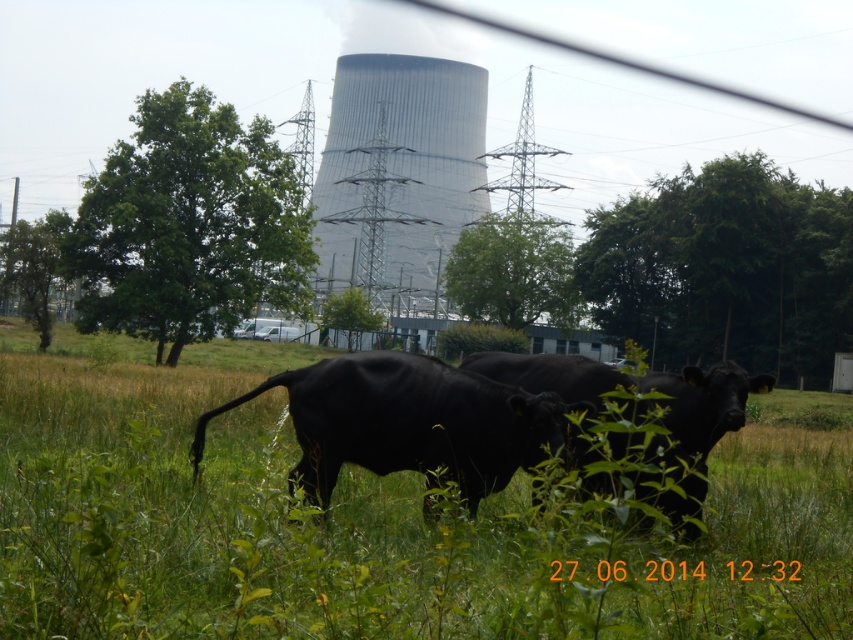
Question: Where is black matte cow at center located in relation to black glossy bull at center in the image?

Choices:
 (A) right
 (B) left

Answer: (B)

Question: Does black matte cow at center have a lesser width compared to black glossy bull at center?

Choices:
 (A) yes
 (B) no

Answer: (B)

Question: Which is nearer to the black glossy bull at center?

Choices:
 (A) smooth concrete tower at center
 (B) black matte cow at center

Answer: (B)

Question: Which point is closer to the camera?

Choices:
 (A) (149, 616)
 (B) (410, 216)
 (C) (323, 364)

Answer: (A)

Question: Estimate the real-world distances between objects in this image. Which object is farther from the black matte cow at center?

Choices:
 (A) black glossy bull at center
 (B) smooth concrete tower at center

Answer: (B)

Question: Does black matte cow at center appear on the right side of smooth concrete tower at center?

Choices:
 (A) no
 (B) yes

Answer: (B)